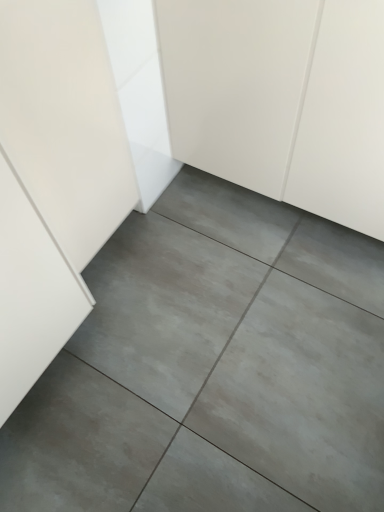
Question: Does gray concrete floor at center have a greater width compared to white matte cabinet at center?

Choices:
 (A) no
 (B) yes

Answer: (B)

Question: Are gray concrete floor at center and white matte cabinet at center making contact?

Choices:
 (A) no
 (B) yes

Answer: (A)

Question: Is gray concrete floor at center positioned beyond the bounds of white matte cabinet at center?

Choices:
 (A) no
 (B) yes

Answer: (B)

Question: Can you confirm if gray concrete floor at center is positioned to the right of white matte cabinet at center?

Choices:
 (A) no
 (B) yes

Answer: (A)

Question: Can you confirm if gray concrete floor at center is shorter than white matte cabinet at center?

Choices:
 (A) yes
 (B) no

Answer: (A)

Question: From the image's perspective, is gray concrete floor at center over white matte cabinet at center?

Choices:
 (A) no
 (B) yes

Answer: (A)

Question: Can you confirm if white matte cabinet at center is smaller than gray concrete floor at center?

Choices:
 (A) no
 (B) yes

Answer: (A)

Question: Can you confirm if white matte cabinet at center is wider than gray concrete floor at center?

Choices:
 (A) no
 (B) yes

Answer: (A)

Question: Considering the relative sizes of white matte cabinet at center and gray concrete floor at center in the image provided, is white matte cabinet at center taller than gray concrete floor at center?

Choices:
 (A) no
 (B) yes

Answer: (B)

Question: Could you tell me if white matte cabinet at center is turned towards gray concrete floor at center?

Choices:
 (A) yes
 (B) no

Answer: (A)

Question: Can you confirm if white matte cabinet at center is positioned to the right of gray concrete floor at center?

Choices:
 (A) no
 (B) yes

Answer: (B)

Question: From a real-world perspective, is white matte cabinet at center physically above gray concrete floor at center?

Choices:
 (A) no
 (B) yes

Answer: (B)

Question: Which is correct: white matte cabinet at center is inside gray concrete floor at center, or outside of it?

Choices:
 (A) inside
 (B) outside

Answer: (B)